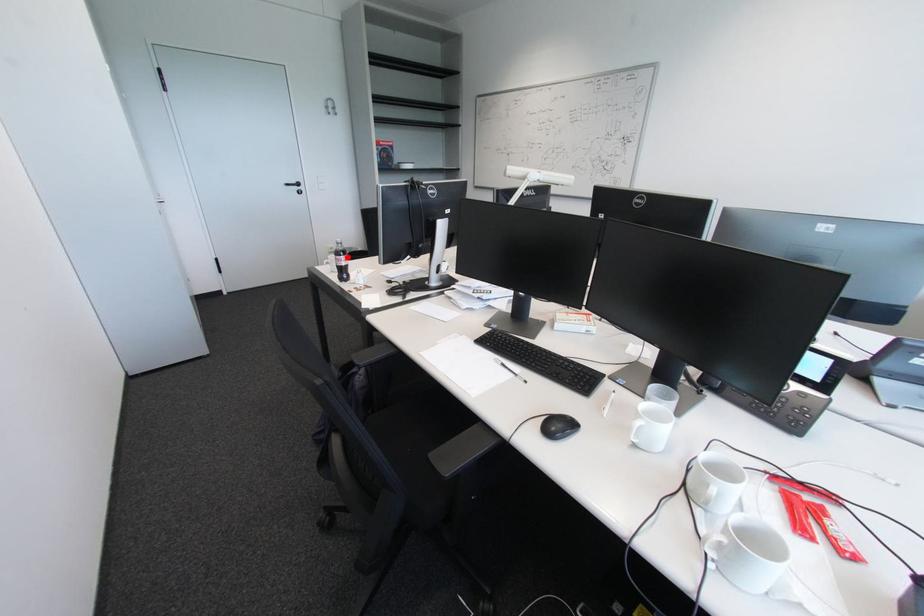
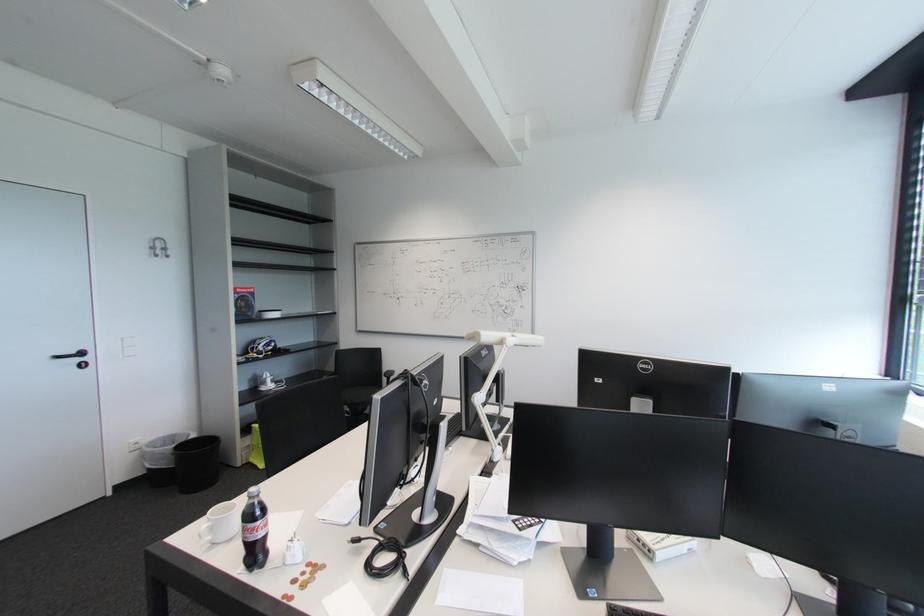
The point at the highlighted location is marked in the first image. Where is the corresponding point in the second image?

(262, 521)